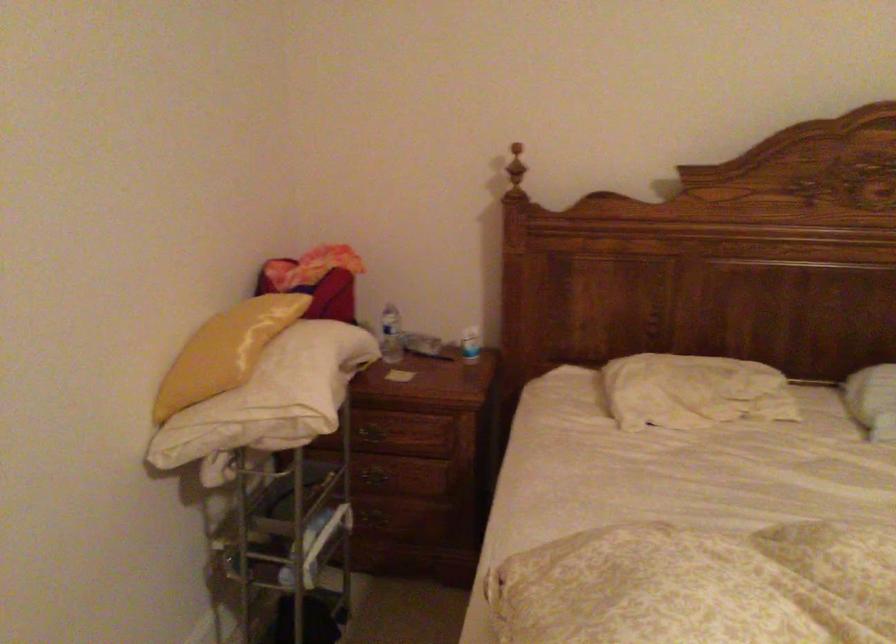
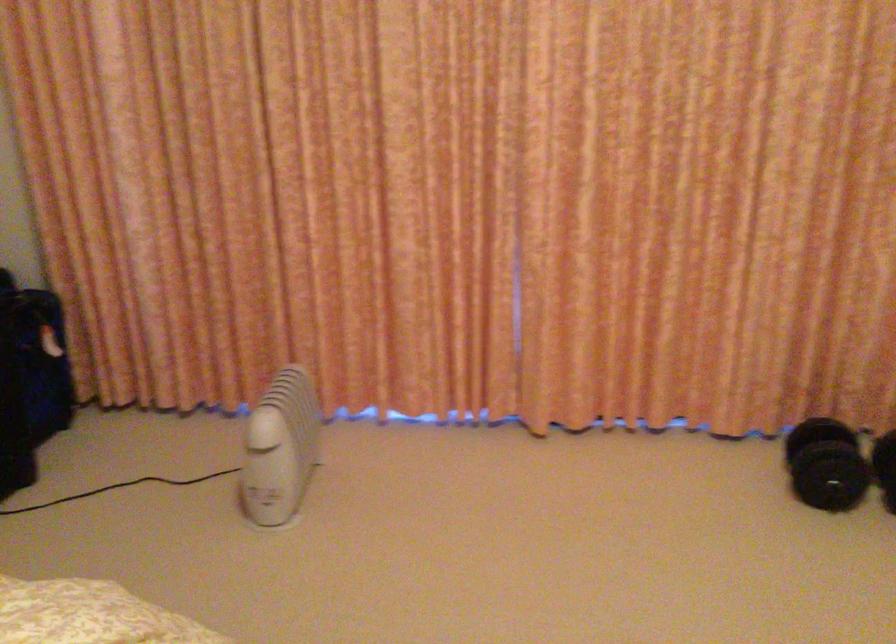
The images are taken continuously from a first-person perspective. In which direction is your viewpoint rotating?

The camera's rotation is toward right-down.